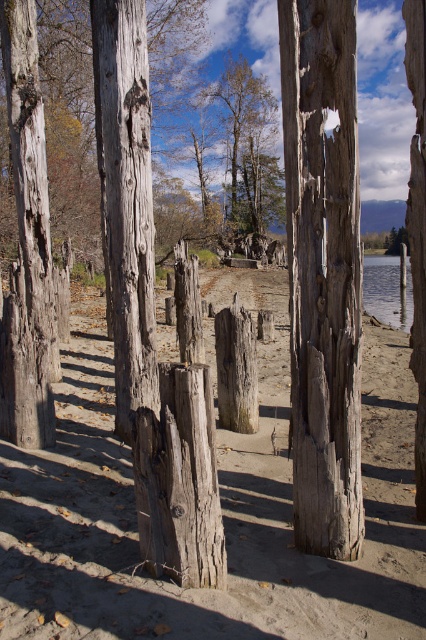
Who is more forward, (250,557) or (259,164)?

Point (250,557)

Is point (383, 580) positioned before point (233, 163)?

That is True.

The width and height of the screenshot is (426, 640). I want to click on weathered wood posts at center, so click(221, 509).

Who is higher up, weathered wood posts at center or weathered wood post at center?

weathered wood post at center is above.

Can you confirm if weathered wood posts at center is bigger than weathered wood post at center?

Correct, weathered wood posts at center is larger in size than weathered wood post at center.

Which is in front, point (88, 492) or point (311, 344)?

Positioned in front is point (311, 344).

Locate an element on the screen. weathered wood posts at center is located at coordinates (221, 509).

Is point (262, 177) less distant than point (233, 355)?

No, it is not.

The width and height of the screenshot is (426, 640). What do you see at coordinates (249, 145) in the screenshot? I see `green leafy tree at center` at bounding box center [249, 145].

Which is behind, point (245, 129) or point (253, 365)?

Point (245, 129)

Locate an element on the screen. green leafy tree at center is located at coordinates (249, 145).